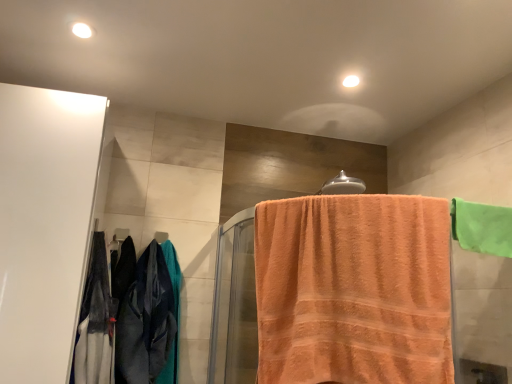
Measure the distance between point (170, 302) and camera.

1.71 meters.

Identify the location of orange terry cloth towel at center, the 1th towel positioned from the left. The image size is (512, 384). (353, 290).

You are a GUI agent. You are given a task and a screenshot of the screen. Output one action in this format:
    pyautogui.click(x=<x>, y=<y>)
    Task: Click on the white glossy cabinet at left
    
    Given the screenshot: What is the action you would take?
    pyautogui.click(x=44, y=225)

What do you see at coordinates (161, 236) in the screenshot?
I see `metallic gray towel bar at upper left, the 1th towel bar in the bottom-to-top sequence` at bounding box center [161, 236].

At what (x,y) coordinates should I click in order to perform the action: click on velvet-like dark blue pants at left. Please return your answer as a coordinate pair (x, y). This screenshot has width=512, height=384. Looking at the image, I should click on (125, 317).

Is white glossy cabinet at left facing towards metallic gray towel bar at upper left, which is the 2th towel bar from front to back?

No, white glossy cabinet at left does not turn towards metallic gray towel bar at upper left, which is the 2th towel bar from front to back.

Locate an element on the screen. This screenshot has width=512, height=384. screen door below the metallic gray towel bar at upper left, which is the 2th towel bar from front to back (from a real-world perspective) is located at coordinates (44, 225).

Is white glossy cabinet at left inside the boundaries of metallic gray towel bar at upper left, which is the 2th towel bar from front to back, or outside?

white glossy cabinet at left is not enclosed by metallic gray towel bar at upper left, which is the 2th towel bar from front to back.

Does white glossy cabinet at left appear on the right side of metallic gray towel bar at upper left, acting as the 1th towel bar starting from the left?

No.

How distant is green fabric towel at upper right, which is counted as the first towel, starting from the right, from metallic gray towel bar at upper left, which is the 2th towel bar from front to back?

They are 3.98 feet apart.

Who is more distant, green fabric towel at upper right, the 2th towel viewed from the left, or metallic gray towel bar at upper left, which is the first towel bar from back to front?

metallic gray towel bar at upper left, which is the first towel bar from back to front, is further away from the camera.

From a real-world perspective, between green fabric towel at upper right, the 2th towel viewed from the left, and metallic gray towel bar at upper left, positioned as the 2th towel bar in top-to-bottom order, who is vertically higher?

green fabric towel at upper right, the 2th towel viewed from the left, from a real-world perspective.

How different are the orientations of green fabric towel at upper right, which is counted as the first towel, starting from the right, and metallic gray towel bar at upper left, acting as the 1th towel bar starting from the left, in degrees?

The angle between the facing direction of green fabric towel at upper right, which is counted as the first towel, starting from the right, and the facing direction of metallic gray towel bar at upper left, acting as the 1th towel bar starting from the left, is 3.73 degrees.

Where is `screen door on the left of velvet-like dark blue pants at left`? screen door on the left of velvet-like dark blue pants at left is located at coordinates (44, 225).

From the image's perspective, which is below, white glossy cabinet at left or velvet-like dark blue pants at left?

velvet-like dark blue pants at left is shown below in the image.

Between white glossy cabinet at left and velvet-like dark blue pants at left, which one has larger width?

With larger width is white glossy cabinet at left.

Considering the sizes of objects white glossy cabinet at left and velvet-like dark blue pants at left in the image provided, who is smaller, white glossy cabinet at left or velvet-like dark blue pants at left?

With smaller size is velvet-like dark blue pants at left.

Is orange terry cloth towel at center, which is counted as the 2th towel, starting from the right, oriented towards green fabric towel at upper right, which is counted as the first towel, starting from the right?

No.

Can you tell me how much orange terry cloth towel at center, which is counted as the 2th towel, starting from the right, and green fabric towel at upper right, which is counted as the first towel, starting from the right, differ in facing direction?

The angle between the facing direction of orange terry cloth towel at center, which is counted as the 2th towel, starting from the right, and the facing direction of green fabric towel at upper right, which is counted as the first towel, starting from the right, is 27.3 degrees.

In the image, is orange terry cloth towel at center, the 1th towel positioned from the left, positioned in front of or behind green fabric towel at upper right, which is counted as the first towel, starting from the right?

Visually, orange terry cloth towel at center, the 1th towel positioned from the left, is located in front of green fabric towel at upper right, which is counted as the first towel, starting from the right.

Considering the sizes of objects orange terry cloth towel at center, the 1th towel positioned from the left, and green fabric towel at upper right, which is counted as the first towel, starting from the right, in the image provided, who is smaller, orange terry cloth towel at center, the 1th towel positioned from the left, or green fabric towel at upper right, which is counted as the first towel, starting from the right,?

Smaller between the two is green fabric towel at upper right, which is counted as the first towel, starting from the right.

Do you think orange terry cloth towel at center, the 1th towel positioned from the left, is within silver metallic towel bar at upper center, marked as the 2th towel bar in a bottom-to-top arrangement, or outside of it?

orange terry cloth towel at center, the 1th towel positioned from the left, is located beyond the bounds of silver metallic towel bar at upper center, marked as the 2th towel bar in a bottom-to-top arrangement.

You are a GUI agent. You are given a task and a screenshot of the screen. Output one action in this format:
    pyautogui.click(x=<x>, y=<y>)
    Task: Click on the 1st towel bar behind when counting from the orange terry cloth towel at center, which is counted as the 2th towel, starting from the right
    The width and height of the screenshot is (512, 384).
    Given the screenshot: What is the action you would take?
    pyautogui.click(x=343, y=185)

Between orange terry cloth towel at center, which is counted as the 2th towel, starting from the right, and silver metallic towel bar at upper center, positioned as the 1th towel bar in front-to-back order, which one has smaller width?

silver metallic towel bar at upper center, positioned as the 1th towel bar in front-to-back order.

What's the angular difference between orange terry cloth towel at center, which is counted as the 2th towel, starting from the right, and silver metallic towel bar at upper center, marked as the 2th towel bar in a bottom-to-top arrangement,'s facing directions?

The angular difference between orange terry cloth towel at center, which is counted as the 2th towel, starting from the right, and silver metallic towel bar at upper center, marked as the 2th towel bar in a bottom-to-top arrangement, is 34.9 degrees.

Is metallic gray towel bar at upper left, which is the 2th towel bar from front to back, directly adjacent to velvet-like dark blue pants at left?

metallic gray towel bar at upper left, which is the 2th towel bar from front to back, is not next to velvet-like dark blue pants at left, and they're not touching.

Locate an element on the screen. clothing beneath the metallic gray towel bar at upper left, acting as the 1th towel bar starting from the left (from a real-world perspective) is located at coordinates [125, 317].

From the picture: Can you tell me how much metallic gray towel bar at upper left, the 1th towel bar in the bottom-to-top sequence, and velvet-like dark blue pants at left differ in facing direction?

The angle between the facing direction of metallic gray towel bar at upper left, the 1th towel bar in the bottom-to-top sequence, and the facing direction of velvet-like dark blue pants at left is 0.000831 degrees.

Could you measure the distance between metallic gray towel bar at upper left, which is the 2th towel bar from front to back, and velvet-like dark blue pants at left?

They are 13.95 inches apart.

Which object is positioned more to the left, white glossy cabinet at left or orange terry cloth towel at center, the 1th towel positioned from the left?

From the viewer's perspective, white glossy cabinet at left appears more on the left side.

Is point (87, 256) closer to camera compared to point (330, 317)?

That is False.

Considering the sizes of objects white glossy cabinet at left and orange terry cloth towel at center, the 1th towel positioned from the left, in the image provided, who is wider, white glossy cabinet at left or orange terry cloth towel at center, the 1th towel positioned from the left,?

white glossy cabinet at left is wider.

Measure the distance from white glossy cabinet at left to orange terry cloth towel at center, which is counted as the 2th towel, starting from the right.

30.99 inches.

The width and height of the screenshot is (512, 384). I want to click on screen door that appears below the metallic gray towel bar at upper left, positioned as the 2th towel bar in top-to-bottom order (from a real-world perspective), so click(x=44, y=225).

Locate an element on the screen. The image size is (512, 384). the 2nd towel counting from the right side of the metallic gray towel bar at upper left, which is the first towel bar from back to front is located at coordinates (482, 227).

Considering their positions, is metallic gray towel bar at upper left, which is the 2th towel bar from front to back, positioned further to velvet-like dark blue pants at left than silver metallic towel bar at upper center, the first towel bar when ordered from top to bottom?

silver metallic towel bar at upper center, the first towel bar when ordered from top to bottom.

Considering their positions, is silver metallic towel bar at upper center, marked as the 2th towel bar in a bottom-to-top arrangement, positioned further to white glossy cabinet at left than velvet-like dark blue pants at left?

Based on the image, silver metallic towel bar at upper center, marked as the 2th towel bar in a bottom-to-top arrangement, appears to be further to white glossy cabinet at left.

Consider the image. Based on their spatial positions, is silver metallic towel bar at upper center, the second towel bar viewed from the back, or green fabric towel at upper right, which is counted as the first towel, starting from the right, closer to velvet-like dark blue pants at left?

silver metallic towel bar at upper center, the second towel bar viewed from the back, is positioned closer to the anchor velvet-like dark blue pants at left.

From the image, which object appears to be nearer to white glossy cabinet at left, velvet-like dark blue pants at left or green fabric towel at upper right, which is counted as the first towel, starting from the right?

Based on the image, velvet-like dark blue pants at left appears to be nearer to white glossy cabinet at left.

Looking at the image, which one is located closer to metallic gray towel bar at upper left, which is the 2th towel bar from front to back, white glossy cabinet at left or orange terry cloth towel at center, the 1th towel positioned from the left?

Based on the image, white glossy cabinet at left appears to be nearer to metallic gray towel bar at upper left, which is the 2th towel bar from front to back.

Estimate the real-world distances between objects in this image. Which object is closer to velvet-like dark blue pants at left, silver metallic towel bar at upper center, the first towel bar when ordered from top to bottom, or orange terry cloth towel at center, the 1th towel positioned from the left?

orange terry cloth towel at center, the 1th towel positioned from the left, is positioned closer to the anchor velvet-like dark blue pants at left.

Considering their positions, is velvet-like dark blue pants at left positioned further to white glossy cabinet at left than silver metallic towel bar at upper center, acting as the first towel bar starting from the right?

silver metallic towel bar at upper center, acting as the first towel bar starting from the right, lies further to white glossy cabinet at left than the other object.

Looking at the image, which one is located closer to white glossy cabinet at left, metallic gray towel bar at upper left, which is the 2th towel bar from front to back, or silver metallic towel bar at upper center, the 2th towel bar viewed from the left?

The object closer to white glossy cabinet at left is metallic gray towel bar at upper left, which is the 2th towel bar from front to back.

Where is `clothing between white glossy cabinet at left and green fabric towel at upper right, the 2th towel viewed from the left`? clothing between white glossy cabinet at left and green fabric towel at upper right, the 2th towel viewed from the left is located at coordinates (125, 317).

I want to click on towel between velvet-like dark blue pants at left and green fabric towel at upper right, the 2th towel viewed from the left, from left to right, so click(x=353, y=290).

Locate an element on the screen. The height and width of the screenshot is (384, 512). towel bar located between metallic gray towel bar at upper left, acting as the 1th towel bar starting from the left, and green fabric towel at upper right, the 2th towel viewed from the left, in the left-right direction is located at coordinates (343, 185).

Identify the location of towel bar between orange terry cloth towel at center, which is counted as the 2th towel, starting from the right, and green fabric towel at upper right, which is counted as the first towel, starting from the right, from left to right. Image resolution: width=512 pixels, height=384 pixels. (343, 185).